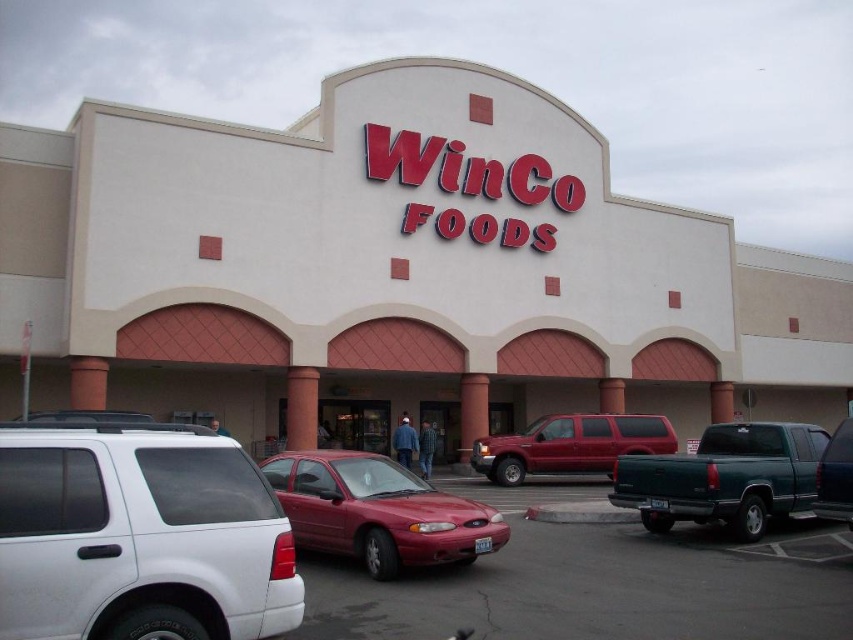
Based on the photo, you are a delivery person who needs to park your vehicle in the parking lot near the WinCo Foods store. You have a tall delivery van that requires a parking spot with enough vertical clearance. Which truck between the green matte truck at right and the metallic dark green truck at right would indicate that the parking spot might be suitable for your van?

The green matte truck at right has a lesser height compared to the metallic dark green truck at right, so the parking spot where the green matte truck at right is parked might have sufficient vertical clearance for your tall delivery van.

You are a delivery driver who needs to park your truck, which is 2 meters wide, in the WinCo Foods parking lot. You see the glossy red car at center and the green matte truck at right. Can your truck fit in the space between them?

The glossy red car at center is narrower than the green matte truck at right, so the space between them may be sufficient for your 2 meter wide truck. However, exact dimensions depend on the distance between the vehicles, which isn not specified in the scene description.

You are standing at the entrance of WinCo Foods and want to locate your car, which is the glossy red car at center. According to the store layout, where should you look relative to the entrance?

The glossy red car at center is located at point 0.800 on the x axis and 0.444 on the y axis relative to the entrance, so you should look towards the center area of the parking lot.